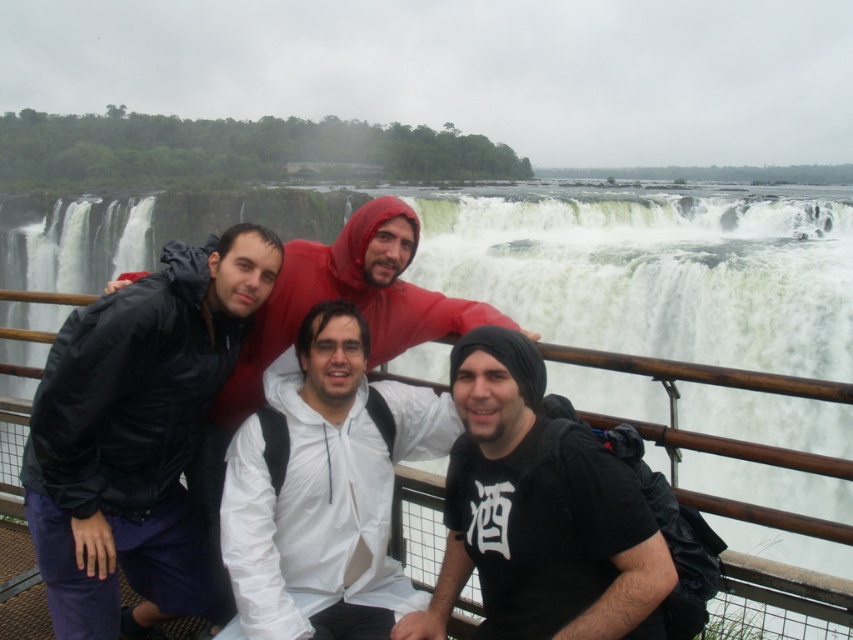
Is matte black jacket at left bigger than white matte jacket at center?

Yes.

Is matte black jacket at left closer to the viewer compared to white matte jacket at center?

That is False.

Between point (83, 323) and point (318, 618), which one is positioned in front?

Point (83, 323) is in front.

I want to click on matte black jacket at left, so click(x=136, y=435).

Can you confirm if matte black jacket at left is bigger than black matte t-shirt at center?

Yes.

The height and width of the screenshot is (640, 853). What do you see at coordinates (136, 435) in the screenshot? I see `matte black jacket at left` at bounding box center [136, 435].

Does point (192, 604) come farther from viewer compared to point (556, 474)?

That is True.

You are a GUI agent. You are given a task and a screenshot of the screen. Output one action in this format:
    pyautogui.click(x=<x>, y=<y>)
    Task: Click on the matte black jacket at left
    
    Given the screenshot: What is the action you would take?
    pyautogui.click(x=136, y=435)

Consider the image. Does black matte t-shirt at center have a smaller size compared to white matte jacket at center?

Actually, black matte t-shirt at center might be larger than white matte jacket at center.

From the picture: Does black matte t-shirt at center have a greater width compared to white matte jacket at center?

Incorrect, black matte t-shirt at center's width does not surpass white matte jacket at center's.

Who is more distant from viewer, (578, 524) or (354, 573)?

Point (354, 573)

You are a GUI agent. You are given a task and a screenshot of the screen. Output one action in this format:
    pyautogui.click(x=<x>, y=<y>)
    Task: Click on the black matte t-shirt at center
    Image resolution: width=853 pixels, height=640 pixels.
    Given the screenshot: What is the action you would take?
    pyautogui.click(x=538, y=513)